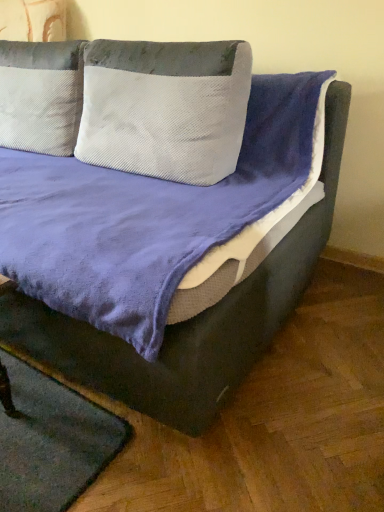
Locate an element on the screen. The image size is (384, 512). vacant space in green felt mat at lower left (from a real-world perspective) is located at coordinates (41, 445).